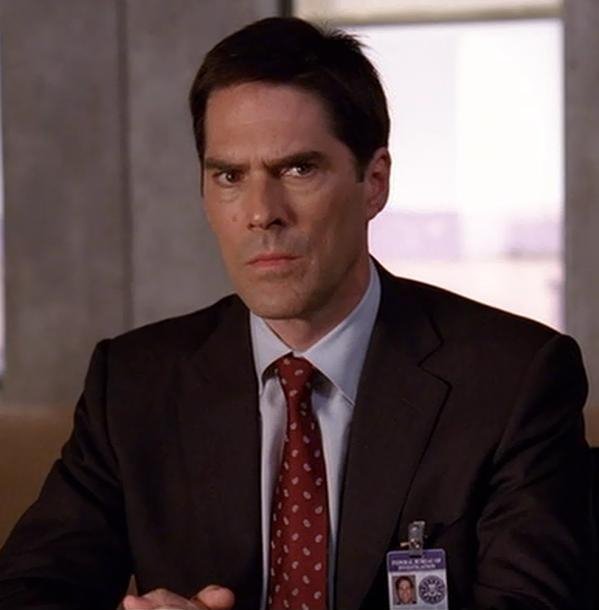
Locate an element on the screen. window is located at coordinates (474, 238).